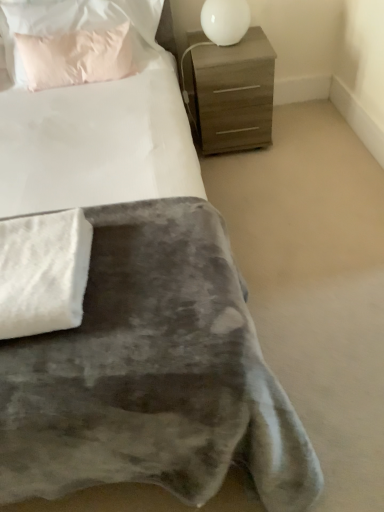
Image resolution: width=384 pixels, height=512 pixels. Identify the location of pink fabric pillow at upper left. (78, 40).

What do you see at coordinates (232, 93) in the screenshot? The width and height of the screenshot is (384, 512). I see `matte brown chest of drawers at upper right` at bounding box center [232, 93].

I want to click on white fluffy blanket at lower left, so click(x=43, y=272).

The image size is (384, 512). I want to click on blanket in front of the pink fabric pillow at upper left, so click(43, 272).

Can you confirm if white fluffy blanket at lower left is thinner than pink fabric pillow at upper left?

In fact, white fluffy blanket at lower left might be wider than pink fabric pillow at upper left.

Which object is more forward, white fluffy blanket at lower left or pink fabric pillow at upper left?

white fluffy blanket at lower left is in front.

Is white fluffy blanket at lower left next to pink fabric pillow at upper left and touching it?

white fluffy blanket at lower left is not next to pink fabric pillow at upper left, and they're not touching.

From a real-world perspective, is pink fabric pillow at upper left below white fluffy blanket at lower left?

No, from a real-world perspective, pink fabric pillow at upper left is not under white fluffy blanket at lower left.

From the image's perspective, which is above, pink fabric pillow at upper left or white fluffy blanket at lower left?

pink fabric pillow at upper left.

Is pink fabric pillow at upper left not inside white fluffy blanket at lower left?

Yes, pink fabric pillow at upper left is located beyond the bounds of white fluffy blanket at lower left.

Which is behind, point (30, 41) or point (21, 269)?

Point (30, 41)

Is matte brown chest of drawers at upper right not near white glossy table lamp at upper right?

matte brown chest of drawers at upper right is actually quite close to white glossy table lamp at upper right.

Does matte brown chest of drawers at upper right have a larger size compared to white glossy table lamp at upper right?

Yes, matte brown chest of drawers at upper right is bigger than white glossy table lamp at upper right.

Which is more to the left, matte brown chest of drawers at upper right or white glossy table lamp at upper right?

white glossy table lamp at upper right is more to the left.

Which is closer to the camera, (211, 111) or (205, 20)?

Point (211, 111) appears to be farther away from the viewer than point (205, 20).

Is white fluffy blanket at lower left positioned with its back to matte brown chest of drawers at upper right?

No, matte brown chest of drawers at upper right is not at the back of white fluffy blanket at lower left.

Based on the photo, from a real-world perspective, is white fluffy blanket at lower left located higher than matte brown chest of drawers at upper right?

Correct, in the physical world, white fluffy blanket at lower left is higher than matte brown chest of drawers at upper right.

Does point (70, 212) appear closer or farther from the camera than point (254, 29)?

Clearly, point (70, 212) is closer to the camera than point (254, 29).

Between white fluffy blanket at lower left and matte brown chest of drawers at upper right, which one has smaller size?

With smaller size is white fluffy blanket at lower left.

From the image's perspective, which one is positioned lower, white fluffy blanket at lower left or white glossy table lamp at upper right?

white fluffy blanket at lower left is shown below in the image.

Considering the relative sizes of white fluffy blanket at lower left and white glossy table lamp at upper right in the image provided, is white fluffy blanket at lower left bigger than white glossy table lamp at upper right?

Actually, white fluffy blanket at lower left might be smaller than white glossy table lamp at upper right.

The height and width of the screenshot is (512, 384). Identify the location of table lamp lying behind the white fluffy blanket at lower left. (225, 20).

In the scene shown: From a real-world perspective, relative to white glossy table lamp at upper right, is pink fabric pillow at upper left vertically above or below?

In terms of real-world spatial position, pink fabric pillow at upper left is above white glossy table lamp at upper right.

Is pink fabric pillow at upper left wider or thinner than white glossy table lamp at upper right?

In the image, pink fabric pillow at upper left appears to be wider than white glossy table lamp at upper right.

In the scene shown: Considering the sizes of pink fabric pillow at upper left and white glossy table lamp at upper right in the image, is pink fabric pillow at upper left bigger or smaller than white glossy table lamp at upper right?

Clearly, pink fabric pillow at upper left is larger in size than white glossy table lamp at upper right.

Is pink fabric pillow at upper left not within white glossy table lamp at upper right?

Yes, pink fabric pillow at upper left is not within white glossy table lamp at upper right.

How many degrees apart are the facing directions of white glossy table lamp at upper right and pink fabric pillow at upper left?

The angle between the facing direction of white glossy table lamp at upper right and the facing direction of pink fabric pillow at upper left is 4.41 degrees.

Is white glossy table lamp at upper right aimed at pink fabric pillow at upper left?

No, white glossy table lamp at upper right is not facing towards pink fabric pillow at upper left.

Is white glossy table lamp at upper right taller or shorter than pink fabric pillow at upper left?

Clearly, white glossy table lamp at upper right is shorter compared to pink fabric pillow at upper left.

Identify the location of blanket below the pink fabric pillow at upper left (from the image's perspective). (x=43, y=272).

The height and width of the screenshot is (512, 384). I want to click on pillow located above the white fluffy blanket at lower left (from the image's perspective), so click(x=78, y=40).

In the scene shown: Estimate the real-world distances between objects in this image. Which object is further from pink fabric pillow at upper left, white glossy table lamp at upper right or matte brown chest of drawers at upper right?

white glossy table lamp at upper right.

Estimate the real-world distances between objects in this image. Which object is further from white glossy table lamp at upper right, pink fabric pillow at upper left or white fluffy blanket at lower left?

The object further to white glossy table lamp at upper right is white fluffy blanket at lower left.

Which object lies nearer to the anchor point pink fabric pillow at upper left, white fluffy blanket at lower left or white glossy table lamp at upper right?

The object closer to pink fabric pillow at upper left is white glossy table lamp at upper right.

Based on the photo, when comparing their distances from matte brown chest of drawers at upper right, does white glossy table lamp at upper right or white fluffy blanket at lower left seem closer?

white glossy table lamp at upper right is positioned closer to the anchor matte brown chest of drawers at upper right.

Estimate the real-world distances between objects in this image. Which object is further from white fluffy blanket at lower left, pink fabric pillow at upper left or matte brown chest of drawers at upper right?

matte brown chest of drawers at upper right.

Based on their spatial positions, is white fluffy blanket at lower left or pink fabric pillow at upper left closer to white glossy table lamp at upper right?

pink fabric pillow at upper left lies closer to white glossy table lamp at upper right than the other object.

Which object lies further to the anchor point white fluffy blanket at lower left, matte brown chest of drawers at upper right or white glossy table lamp at upper right?

white glossy table lamp at upper right.

Which object lies nearer to the anchor point matte brown chest of drawers at upper right, white glossy table lamp at upper right or pink fabric pillow at upper left?

white glossy table lamp at upper right.

Locate an element on the screen. Image resolution: width=384 pixels, height=512 pixels. chest of drawers between pink fabric pillow at upper left and white fluffy blanket at lower left in the up-down direction is located at coordinates (232, 93).

Find the location of `table lamp between pink fabric pillow at upper left and matte brown chest of drawers at upper right`. table lamp between pink fabric pillow at upper left and matte brown chest of drawers at upper right is located at coordinates (225, 20).

The width and height of the screenshot is (384, 512). I want to click on the chest of drawers between white glossy table lamp at upper right and white fluffy blanket at lower left vertically, so click(x=232, y=93).

Locate an element on the screen. pillow that lies between white glossy table lamp at upper right and white fluffy blanket at lower left from top to bottom is located at coordinates (78, 40).